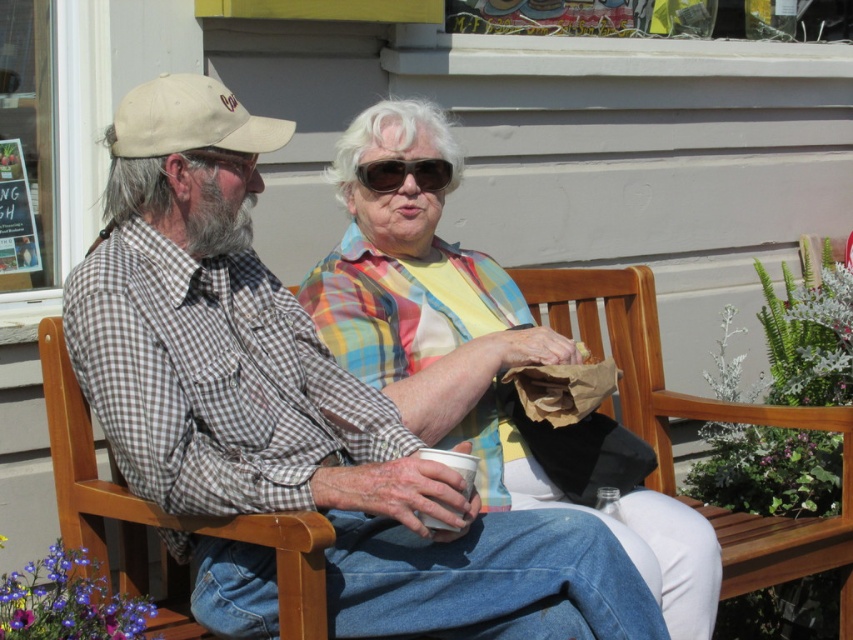
Can you confirm if plaid shirt at center is taller than wooden bench at center?

Correct, plaid shirt at center is much taller as wooden bench at center.

Is plaid shirt at center below wooden bench at center?

No, plaid shirt at center is not below wooden bench at center.

Does point (523, 314) come closer to viewer compared to point (137, 534)?

No, (523, 314) is further to viewer.

Where is `plaid shirt at center`? plaid shirt at center is located at coordinates (471, 352).

Is wooden bench at center smaller than black plastic sunglasses at center?

No, wooden bench at center is not smaller than black plastic sunglasses at center.

Measure the distance between point (x=123, y=545) and camera.

Point (x=123, y=545) is 2.55 meters away from camera.

Where is `wooden bench at center`? This screenshot has height=640, width=853. wooden bench at center is located at coordinates (699, 419).

Between point (404, 339) and point (383, 193), which one is positioned behind?

Point (383, 193)

Is plaid shirt at center to the left of black plastic sunglasses at center from the viewer's perspective?

No, plaid shirt at center is not to the left of black plastic sunglasses at center.

Locate an element on the screen. The width and height of the screenshot is (853, 640). plaid shirt at center is located at coordinates (471, 352).

The height and width of the screenshot is (640, 853). What are the coordinates of `plaid shirt at center` in the screenshot? It's located at (471, 352).